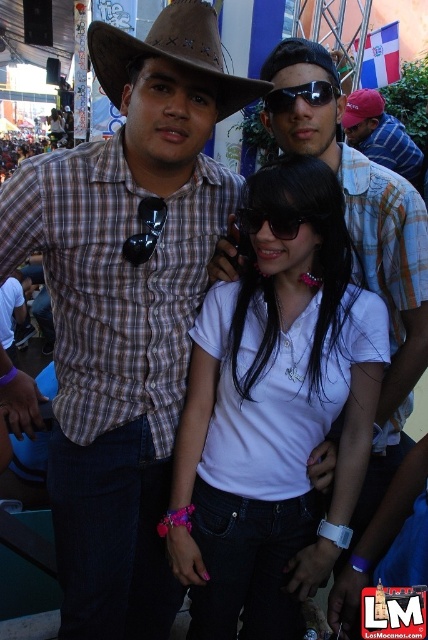
Question: Is red cap at center positioned in front of red cotton cap at upper center?

Choices:
 (A) yes
 (B) no

Answer: (B)

Question: Which is nearer to the red cotton cap at upper center?

Choices:
 (A) brown plaid shirt at center
 (B) red cap at center
 (C) black plastic sunglasses at center

Answer: (B)

Question: Can you confirm if white matte shirt at center is positioned above sunglasses at center?

Choices:
 (A) no
 (B) yes

Answer: (A)

Question: Which of the following is the farthest from the observer?

Choices:
 (A) black plastic sunglasses at center
 (B) red cap at center
 (C) red cotton cap at upper center
 (D) brown leather fedora at upper left

Answer: (B)

Question: Does black plastic sunglasses at center have a smaller size compared to sunglasses at center?

Choices:
 (A) no
 (B) yes

Answer: (A)

Question: Among these objects, which one is farthest from the camera?

Choices:
 (A) white matte shirt at center
 (B) brown plaid shirt at center

Answer: (A)